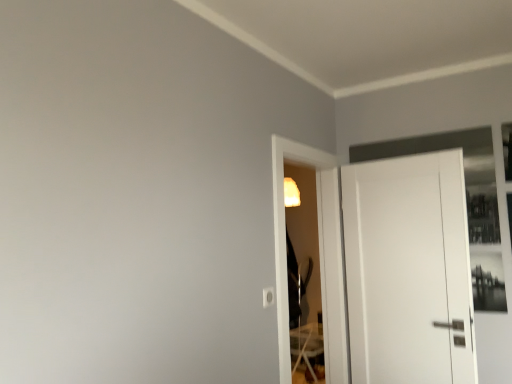
In order to face transparent glass screen door at center, should I rotate leftwards or rightwards?

Rotate right and turn 7.113 degrees.

What do you see at coordinates (319, 256) in the screenshot?
I see `transparent glass screen door at center` at bounding box center [319, 256].

The height and width of the screenshot is (384, 512). I want to click on transparent glass screen door at center, so click(x=319, y=256).

Describe the element at coordinates (409, 271) in the screenshot. I see `white matte door at right` at that location.

Find the location of a particular element. This screenshot has height=384, width=512. white matte door at right is located at coordinates (409, 271).

The height and width of the screenshot is (384, 512). I want to click on transparent glass screen door at center, so click(319, 256).

Considering the positions of objects white matte door at right and transparent glass screen door at center in the image provided, who is more to the right, white matte door at right or transparent glass screen door at center?

white matte door at right.

Is white matte door at right further to camera compared to transparent glass screen door at center?

That is True.

Does point (389, 297) come closer to viewer compared to point (284, 209)?

No.

From the image's perspective, does white matte door at right appear higher than transparent glass screen door at center?

No, from the image's perspective, white matte door at right is not above transparent glass screen door at center.

From a real-world perspective, is white matte door at right under transparent glass screen door at center?

Yes, from a real-world perspective, white matte door at right is below transparent glass screen door at center.

Consider the image. Can you confirm if white matte door at right is wider than transparent glass screen door at center?

No, white matte door at right is not wider than transparent glass screen door at center.

Between white matte door at right and transparent glass screen door at center, which one has less height?

With less height is white matte door at right.

Can you confirm if white matte door at right is smaller than transparent glass screen door at center?

Correct, white matte door at right occupies less space than transparent glass screen door at center.

Which is correct: white matte door at right is inside transparent glass screen door at center, or outside of it?

white matte door at right is outside transparent glass screen door at center.

Would you say white matte door at right is a long distance from transparent glass screen door at center?

No, white matte door at right is in close proximity to transparent glass screen door at center.

Could you tell me if white matte door at right is facing transparent glass screen door at center?

Yes, white matte door at right faces towards transparent glass screen door at center.

Based on the photo, how many degrees apart are the facing directions of white matte door at right and transparent glass screen door at center?

101 degrees.

Where is `door lying on the right of transparent glass screen door at center`? The width and height of the screenshot is (512, 384). door lying on the right of transparent glass screen door at center is located at coordinates (409, 271).

Considering the positions of objects transparent glass screen door at center and white matte door at right in the image provided, who is more to the left, transparent glass screen door at center or white matte door at right?

Positioned to the left is transparent glass screen door at center.

Which is behind, transparent glass screen door at center or white matte door at right?

Positioned behind is white matte door at right.

Which is closer, (333, 234) or (371, 248)?

The point (371, 248) is closer.

From the image's perspective, is transparent glass screen door at center above or below white matte door at right?

Based on their image positions, transparent glass screen door at center is located above white matte door at right.

From a real-world perspective, is transparent glass screen door at center physically located above or below white matte door at right?

In terms of real-world spatial position, transparent glass screen door at center is above white matte door at right.

Can you confirm if transparent glass screen door at center is wider than white matte door at right?

Yes.

Which of these two, transparent glass screen door at center or white matte door at right, stands shorter?

Standing shorter between the two is white matte door at right.

Does transparent glass screen door at center have a larger size compared to white matte door at right?

Yes, transparent glass screen door at center is bigger than white matte door at right.

Is transparent glass screen door at center not within white matte door at right?

Yes, transparent glass screen door at center is not within white matte door at right.

Would you say transparent glass screen door at center is a long distance from white matte door at right?

No, transparent glass screen door at center is in close proximity to white matte door at right.

Could you tell me if transparent glass screen door at center is facing white matte door at right?

Yes, transparent glass screen door at center is aimed at white matte door at right.

What's the angular difference between transparent glass screen door at center and white matte door at right's facing directions?

transparent glass screen door at center and white matte door at right are facing 101 degrees away from each other.

In the image, there is a transparent glass screen door at center. Where is `door below it (from a real-world perspective)`? The image size is (512, 384). door below it (from a real-world perspective) is located at coordinates (409, 271).

Where is `door below the transparent glass screen door at center (from the image's perspective)`? The width and height of the screenshot is (512, 384). door below the transparent glass screen door at center (from the image's perspective) is located at coordinates (409, 271).

Locate an element on the screen. Image resolution: width=512 pixels, height=384 pixels. screen door on the left of white matte door at right is located at coordinates (319, 256).